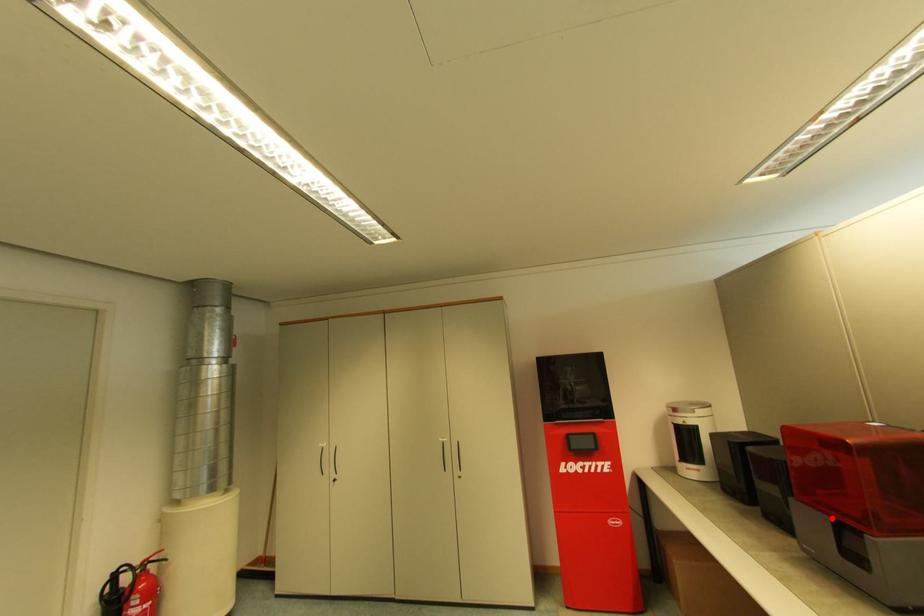
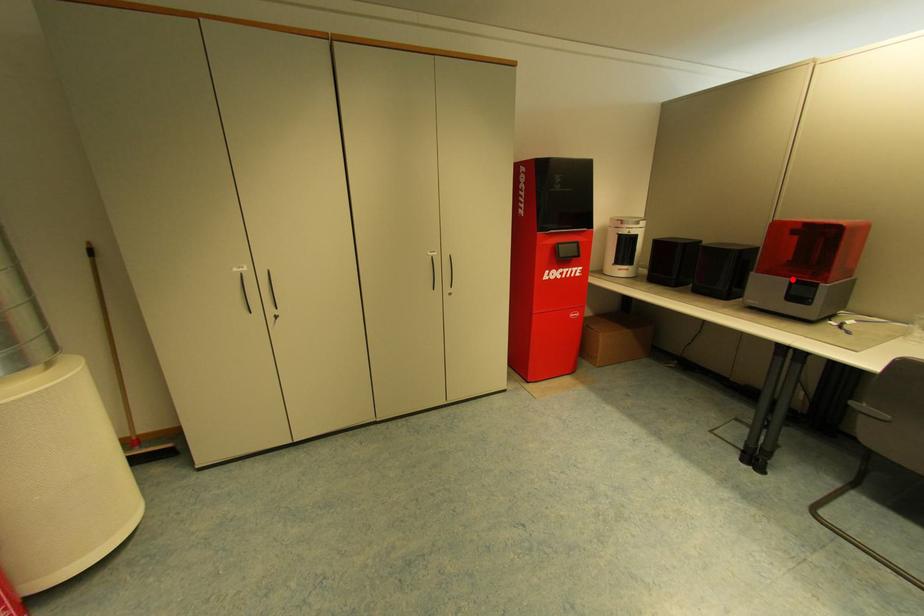
I am providing you with two images of the same scene from different viewpoints. A red point is marked on the first image and another point is marked on the second image. Is the red point in image1 aligned with the point shown in image2?

Yes